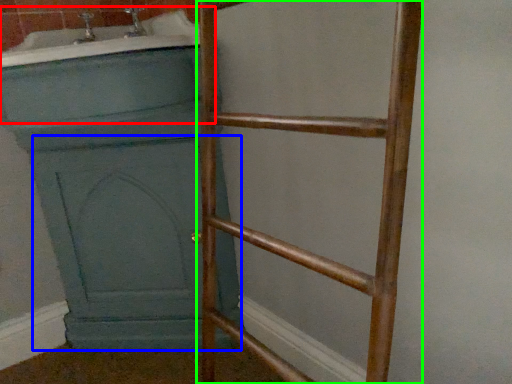
Question: Which object is the closest to the bath (highlighted by a red box)? Choose among these: screen door (highlighted by a blue box) or ladder (highlighted by a green box).

Choices:
 (A) screen door
 (B) ladder

Answer: (B)